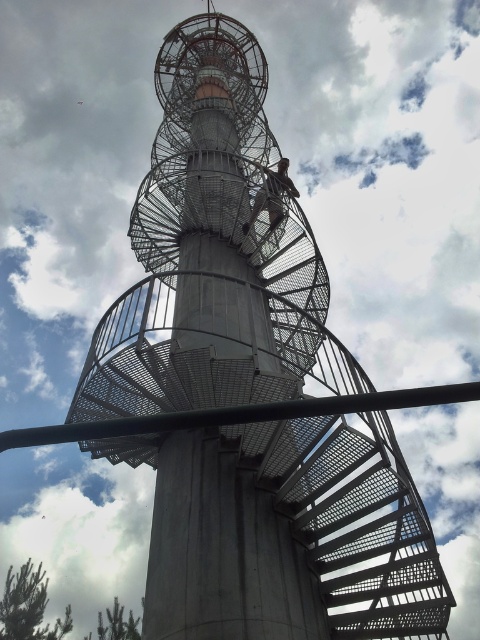
Image resolution: width=480 pixels, height=640 pixels. Find the location of `concrete staircase at center`. concrete staircase at center is located at coordinates (240, 413).

Can you confirm if concrete staircase at center is smaller than metallic climbing harness at center?

Actually, concrete staircase at center might be larger than metallic climbing harness at center.

Who is more distant from viewer, (116, 429) or (283, 216)?

The point (283, 216) is behind.

This screenshot has width=480, height=640. I want to click on concrete staircase at center, so click(240, 413).